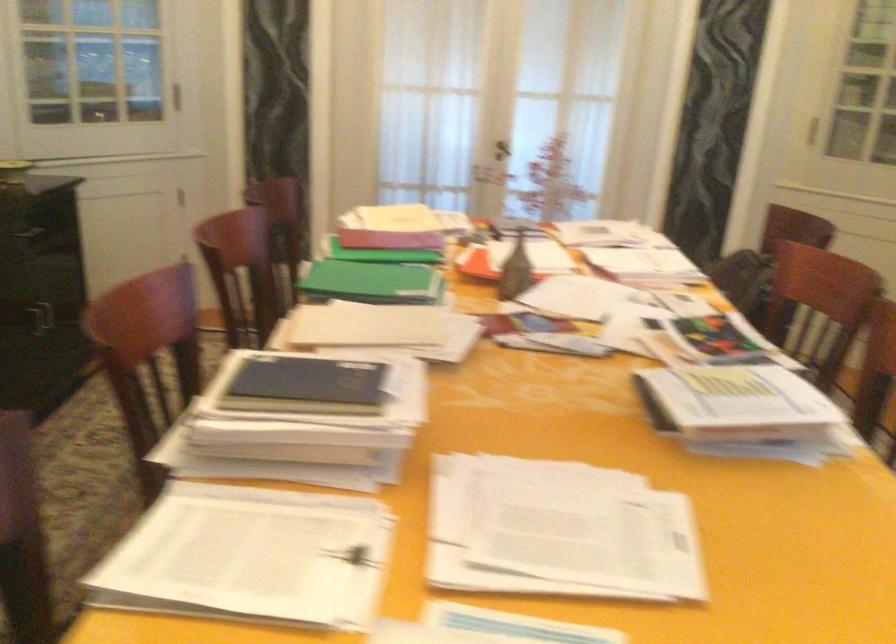
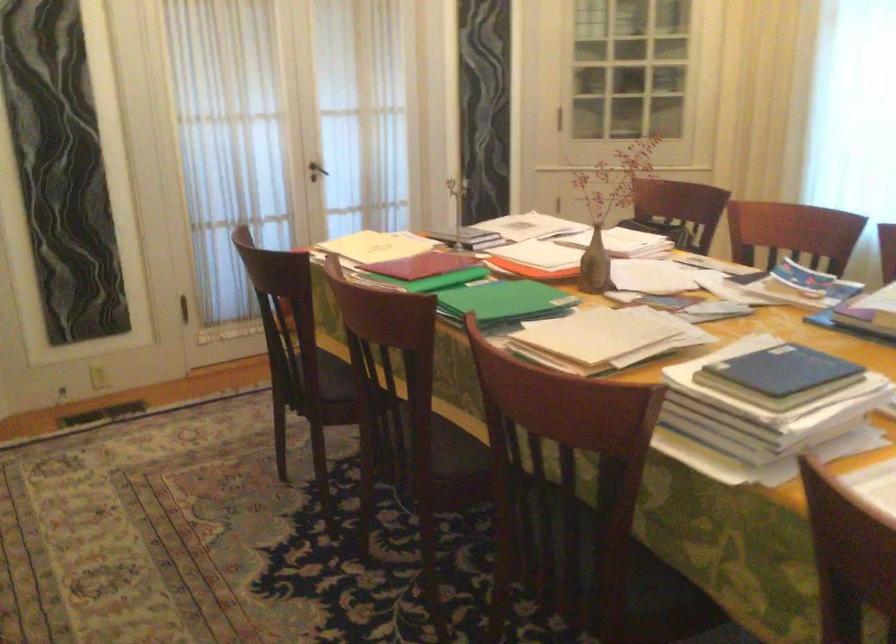
The point at (324,389) is marked in the first image. Where is the corresponding point in the second image?

(782, 370)